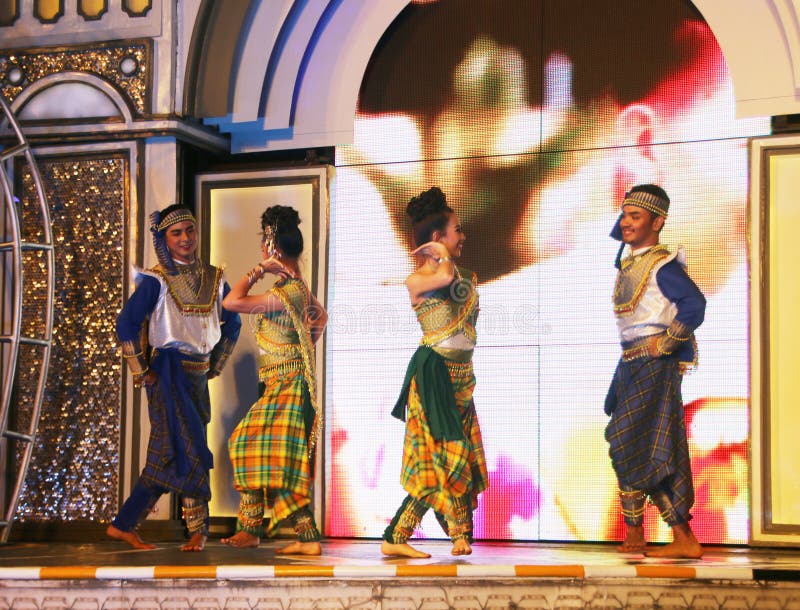
Find the location of a particular element. The width and height of the screenshot is (800, 610). sparkly/sequined wall is located at coordinates (84, 256), (90, 61).